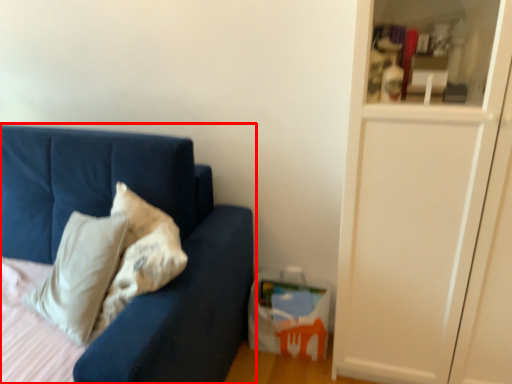
Question: Where is studio couch (annotated by the red box) located in relation to glass door in the image?

Choices:
 (A) left
 (B) right

Answer: (A)